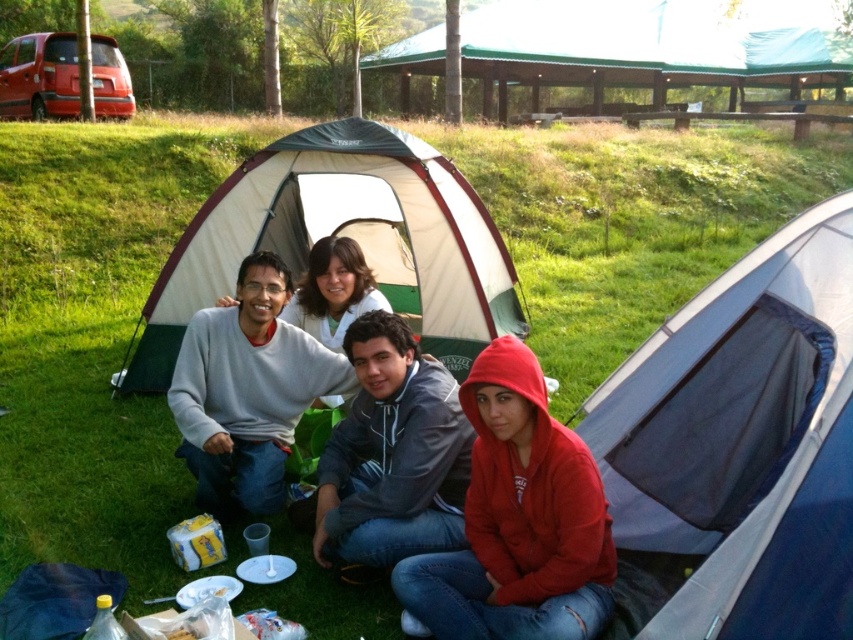
In the scene shown: You are a photographer setting up a shot of the blue fabric tent at center and the gray matte sweater at center. Based on their positions, which object should you focus on first to ensure both are in frame?

The blue fabric tent at center is located below the gray matte sweater at center, so you should focus on the gray matte sweater at center first to ensure both are in frame.

You are planning to set up a tent in your backyard and want to ensure it can accommodate a person wearing a gray matte sweater at center. Given the blue fabric tent at center is available, will it fit comfortably?

The blue fabric tent at center has a larger width than the gray matte sweater at center, so it should comfortably accommodate a person wearing the gray matte sweater at center.

Based on the scene description, can you determine which object is larger between the white canvas tent at center and the red fleece hoodie at lower right?

The white canvas tent at center is bigger than the red fleece hoodie at lower right according to the description.